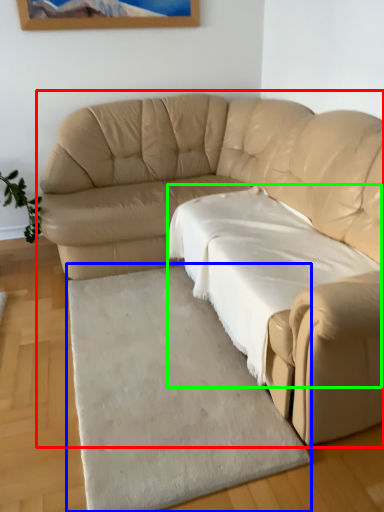
Question: Which object is the farthest from studio couch (highlighted by a red box)? Choose among these: mat (highlighted by a blue box) or sheet (highlighted by a green box).

Choices:
 (A) mat
 (B) sheet

Answer: (A)